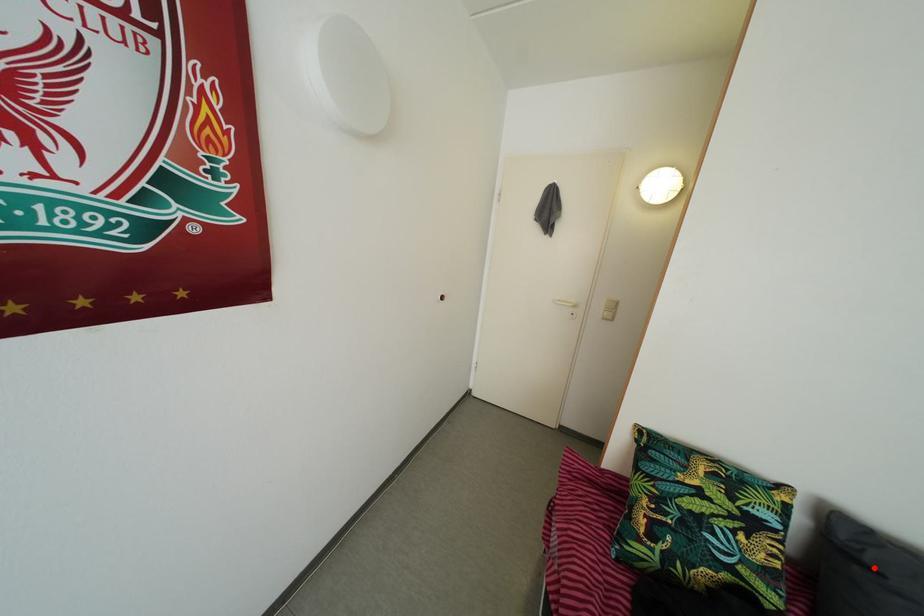
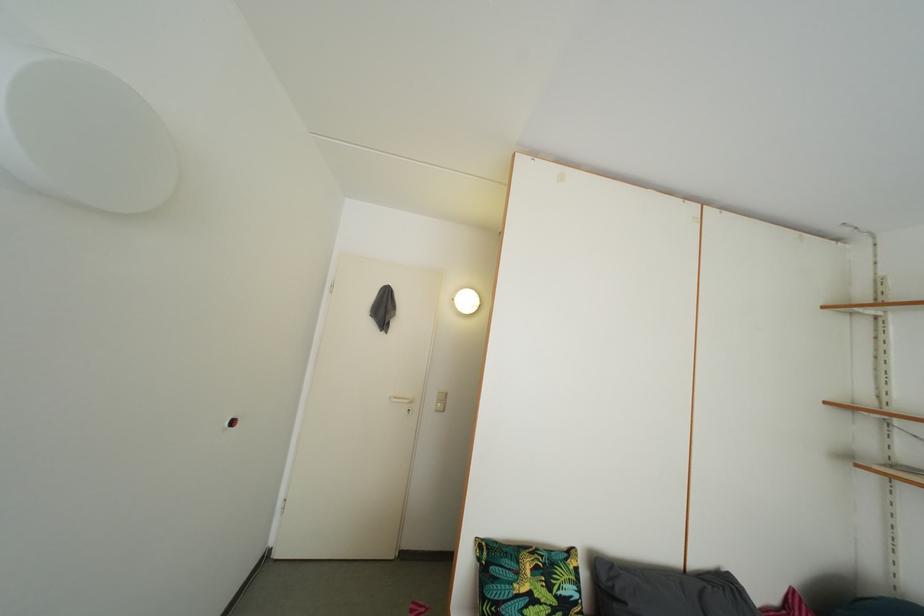
Locate, in the second image, the point that corresponds to the highlighted location in the first image.

(624, 601)